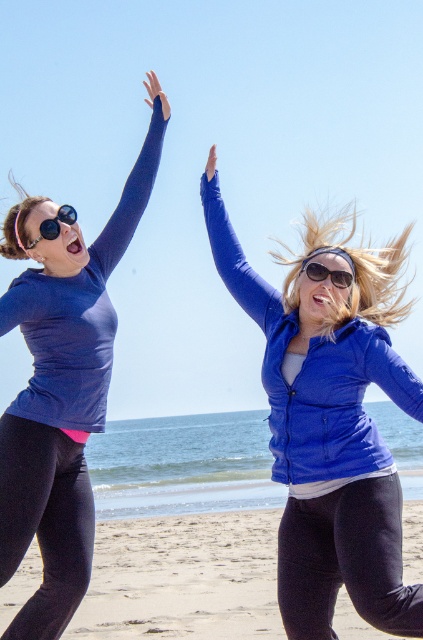
Question: Which is nearer to the matte blue jacket at upper center?

Choices:
 (A) blue matte arm at upper center
 (B) sunglasses at center
 (C) matte blue shirt at left
 (D) matte blue arm at upper left

Answer: (B)

Question: Does blue shiny jacket at center appear over matte blue shirt at left?

Choices:
 (A) yes
 (B) no

Answer: (B)

Question: Which object appears farthest from the camera in this image?

Choices:
 (A) matte blue jacket at upper center
 (B) sandy beach at lower center
 (C) sunglasses at center
 (D) blue shiny jacket at center

Answer: (B)

Question: Which object is positioned farthest from the matte blue arm at upper left?

Choices:
 (A) sandy beach at lower center
 (B) sunglasses at center
 (C) matte blue jacket at upper center
 (D) blue shiny jacket at center

Answer: (A)

Question: Is sandy beach at lower center to the left of matte blue arm at upper left from the viewer's perspective?

Choices:
 (A) no
 (B) yes

Answer: (A)

Question: Is matte blue jacket at upper center bigger than sunglasses at center?

Choices:
 (A) no
 (B) yes

Answer: (B)